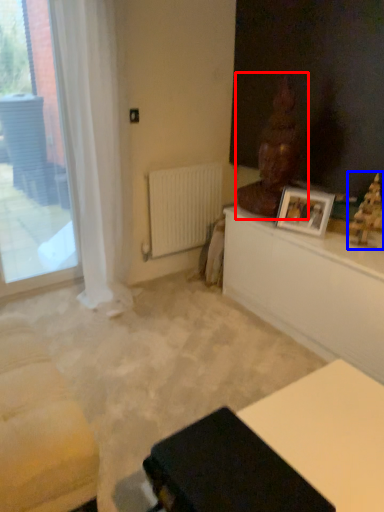
Question: Which object appears closest to the camera in this image, sculpture (highlighted by a red box) or sculpture (highlighted by a blue box)?

Choices:
 (A) sculpture
 (B) sculpture

Answer: (B)